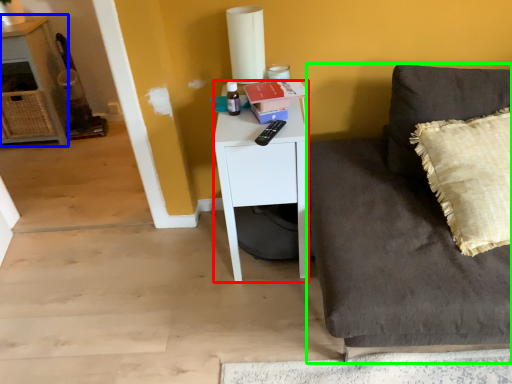
Question: Which object is the closest to the desk (highlighted by a red box)? Choose among these: cabinetry (highlighted by a blue box) or studio couch (highlighted by a green box).

Choices:
 (A) cabinetry
 (B) studio couch

Answer: (B)